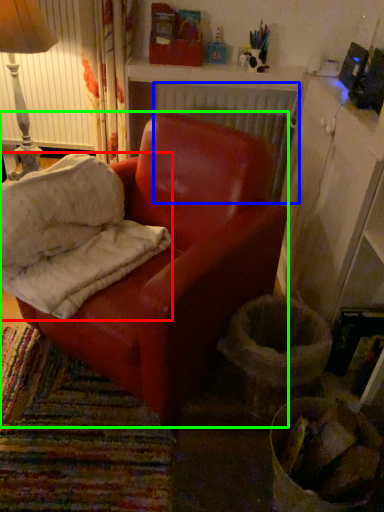
Question: Which is nearer to the material (highlighted by a red box)? radiator (highlighted by a blue box) or chair (highlighted by a green box).

Choices:
 (A) radiator
 (B) chair

Answer: (B)